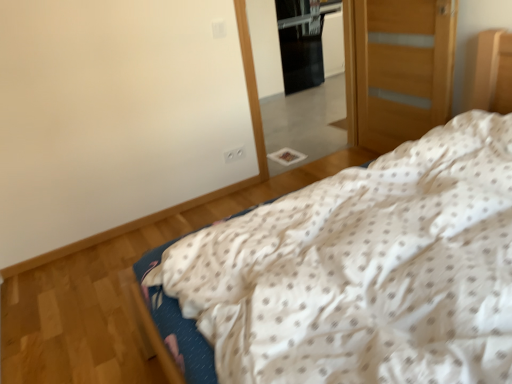
Question: Considering the relative positions of black glass screen door at upper center and white dotted fabric at center in the image provided, is black glass screen door at upper center to the left of white dotted fabric at center from the viewer's perspective?

Choices:
 (A) no
 (B) yes

Answer: (B)

Question: Does black glass screen door at upper center contain white dotted fabric at center?

Choices:
 (A) yes
 (B) no

Answer: (B)

Question: Is black glass screen door at upper center oriented towards white dotted fabric at center?

Choices:
 (A) yes
 (B) no

Answer: (B)

Question: Is black glass screen door at upper center bigger than white dotted fabric at center?

Choices:
 (A) yes
 (B) no

Answer: (A)

Question: Does black glass screen door at upper center appear on the right side of white dotted fabric at center?

Choices:
 (A) no
 (B) yes

Answer: (A)

Question: In terms of height, does clear glass mirror at center look taller or shorter compared to white dotted fabric at center?

Choices:
 (A) short
 (B) tall

Answer: (B)

Question: In the image, is clear glass mirror at center positioned in front of or behind white dotted fabric at center?

Choices:
 (A) front
 (B) behind

Answer: (B)

Question: From a real-world perspective, is clear glass mirror at center positioned above or below white dotted fabric at center?

Choices:
 (A) above
 (B) below

Answer: (B)

Question: Considering the positions of clear glass mirror at center and white dotted fabric at center in the image, is clear glass mirror at center wider or thinner than white dotted fabric at center?

Choices:
 (A) wide
 (B) thin

Answer: (B)

Question: Based on their positions, is white dotted fabric at center located to the left or right of wooden door at right?

Choices:
 (A) left
 (B) right

Answer: (A)

Question: Is point (257, 215) closer or farther from the camera than point (345, 36)?

Choices:
 (A) farther
 (B) closer

Answer: (B)

Question: In terms of height, does white dotted fabric at center look taller or shorter compared to wooden door at right?

Choices:
 (A) tall
 (B) short

Answer: (B)

Question: Looking at the image, does white dotted fabric at center seem bigger or smaller compared to wooden door at right?

Choices:
 (A) big
 (B) small

Answer: (A)

Question: Is clear glass mirror at center taller or shorter than wooden door at right?

Choices:
 (A) tall
 (B) short

Answer: (A)

Question: In terms of width, does clear glass mirror at center look wider or thinner when compared to wooden door at right?

Choices:
 (A) wide
 (B) thin

Answer: (A)